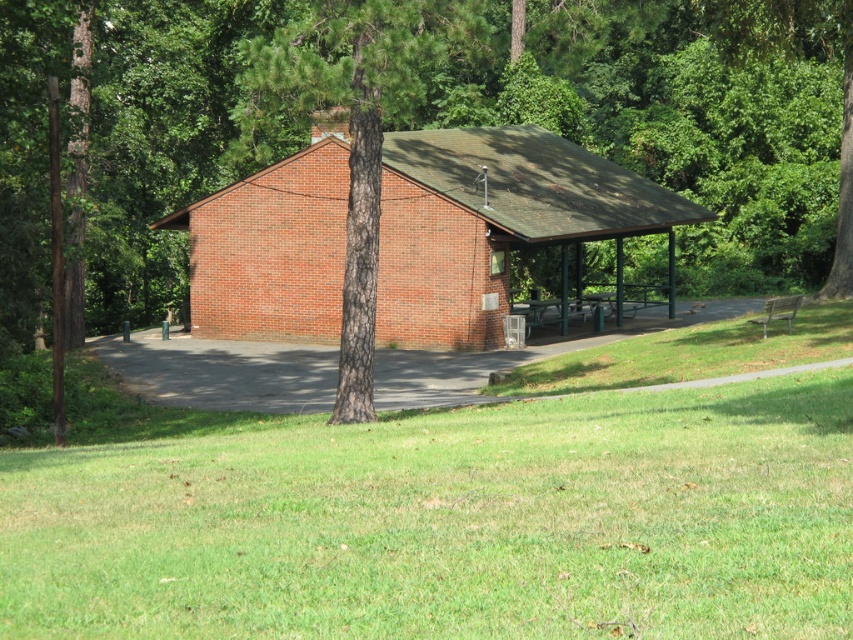
Question: Does brick hut at center appear on the right side of green metal picnic table at center?

Choices:
 (A) no
 (B) yes

Answer: (A)

Question: Is green grass at center wider than smooth bark tree at center?

Choices:
 (A) no
 (B) yes

Answer: (A)

Question: Which point is farther to the camera?

Choices:
 (A) smooth bark tree at center
 (B) brown rough bark tree at center

Answer: (A)

Question: Based on their relative distances, which object is nearer to the green metal picnic table at center?

Choices:
 (A) brick hut at center
 (B) smooth bark tree at center
 (C) green grass at center

Answer: (A)

Question: Which object appears farthest from the camera in this image?

Choices:
 (A) green metal picnic table at center
 (B) green grass at center
 (C) brick hut at center
 (D) smooth bark tree at center

Answer: (A)

Question: Does brick hut at center have a lesser width compared to brown rough bark tree at center?

Choices:
 (A) no
 (B) yes

Answer: (A)